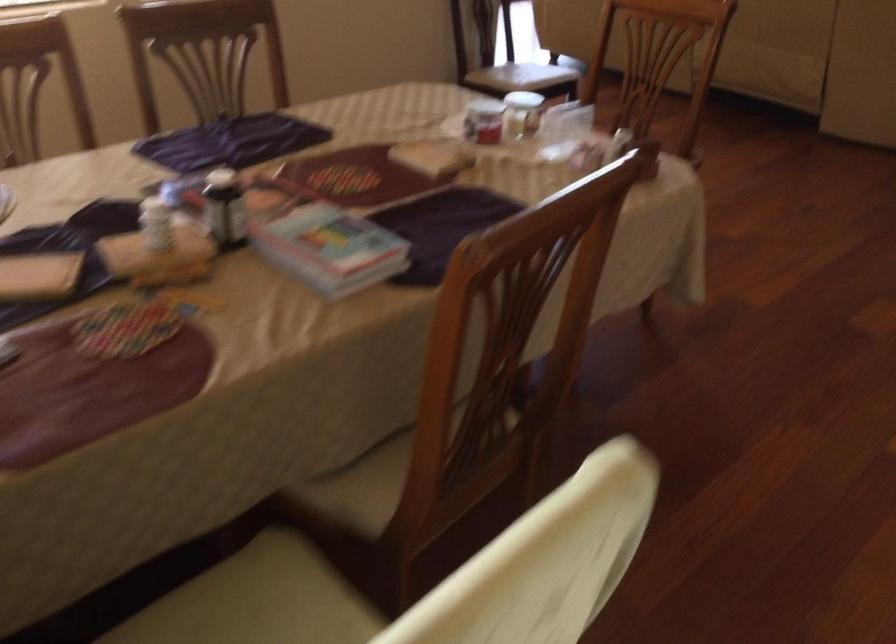
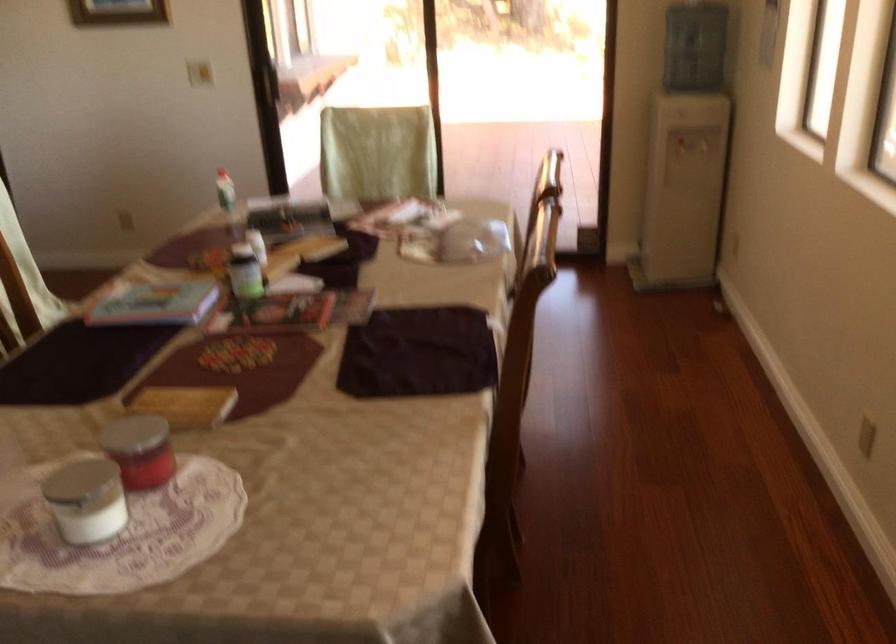
The point at (527, 100) is marked in the first image. Where is the corresponding point in the second image?

(85, 500)